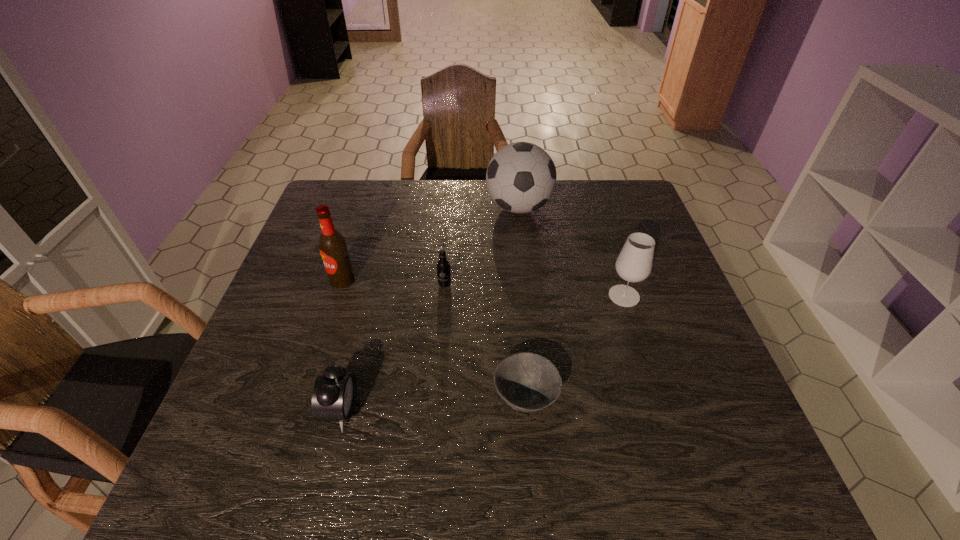
Identify the location of free space located 0.360m on the left of the farthest object. Image resolution: width=960 pixels, height=540 pixels. (371, 207).

The height and width of the screenshot is (540, 960). In order to click on free space located on the front of the fourth shortest object in this screenshot , I will do `click(665, 422)`.

Find the location of a particular element. Image resolution: width=960 pixels, height=540 pixels. vacant space located on the label of the fourth object from right to left is located at coordinates (432, 435).

Identify the location of vacant space located on the front side of the alarm clock. (542, 410).

The image size is (960, 540). In order to click on vacant space located 0.280m on the back of the bowl in this screenshot , I will do `click(516, 279)`.

Identify the location of object located at the far edge. (521, 177).

Where is `object that is at the left edge`? The image size is (960, 540). object that is at the left edge is located at coordinates (333, 248).

This screenshot has height=540, width=960. In order to click on object at the right edge in this screenshot , I will do `click(634, 264)`.

Where is `vacant area at the far edge`? The height and width of the screenshot is (540, 960). vacant area at the far edge is located at coordinates (545, 206).

Where is `blank space at the near edge of the desktop`? Image resolution: width=960 pixels, height=540 pixels. blank space at the near edge of the desktop is located at coordinates (298, 484).